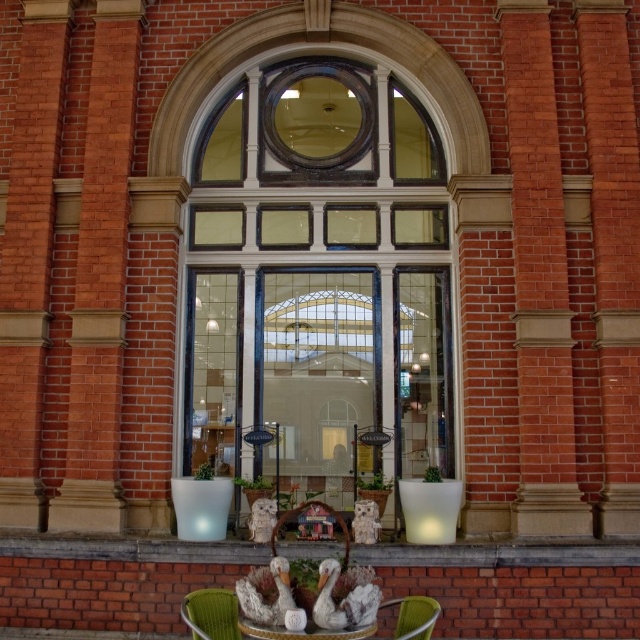
Question: Which point is farther to the camera?

Choices:
 (A) (422, 252)
 (B) (372, 628)
 (C) (339, 520)

Answer: (A)

Question: Does green fabric chair at lower center have a greater width compared to wooden chair at center?

Choices:
 (A) no
 (B) yes

Answer: (A)

Question: Which point is farther to the camera?

Choices:
 (A) (413, 630)
 (B) (346, 632)

Answer: (A)

Question: Is green fabric chair at lower center smaller than metallic green chair at lower center?

Choices:
 (A) yes
 (B) no

Answer: (A)

Question: Which object is the farthest from the wooden chair at center?

Choices:
 (A) metallic green chair at lower center
 (B) wooden textured table at center
 (C) green fabric chair at lower center
 (D) clear glass door at center

Answer: (D)

Question: Does wooden textured table at center appear over wooden chair at center?

Choices:
 (A) no
 (B) yes

Answer: (A)